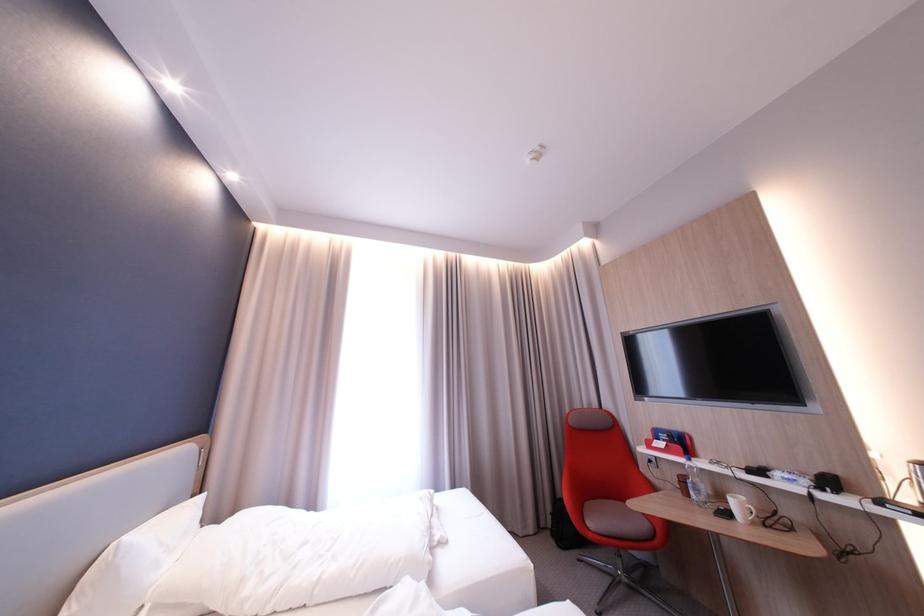
Find the location of a particular element. red chair sitting surface is located at coordinates (x=624, y=528).